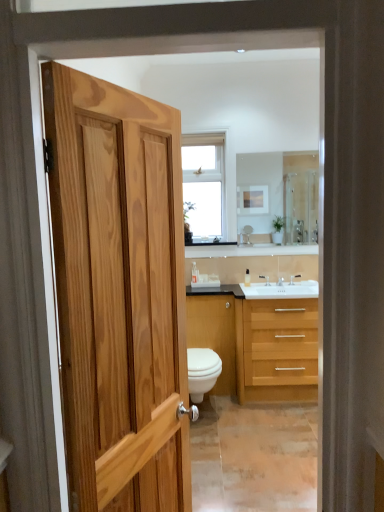
Describe the element at coordinates (257, 342) in the screenshot. I see `light wood/finished cabinet at center` at that location.

The width and height of the screenshot is (384, 512). What do you see at coordinates (247, 278) in the screenshot?
I see `translucent plastic bottle at center` at bounding box center [247, 278].

What do you see at coordinates (294, 278) in the screenshot? The height and width of the screenshot is (512, 384). I see `silver metallic faucet at center, which is the first faucet from right to left` at bounding box center [294, 278].

Identify the location of white glossy toilet at center. This screenshot has width=384, height=512. (202, 372).

At what (x,y) coordinates should I click in order to perform the action: click on silver metallic faucet at center, the 1th faucet from the left. Please return your answer as a coordinate pair (x, y). This screenshot has width=384, height=512. Looking at the image, I should click on (265, 279).

Can you see clear glass window at upper center touching satin nickel faucet at center, which appears as the 2th faucet when viewed from the left?

No, clear glass window at upper center is not next to satin nickel faucet at center, which appears as the 2th faucet when viewed from the left.

From the image's perspective, is clear glass window at upper center under satin nickel faucet at center, which is counted as the second faucet, starting from the right?

Actually, clear glass window at upper center appears above satin nickel faucet at center, which is counted as the second faucet, starting from the right, in the image.

At what (x,y) coordinates should I click in order to perform the action: click on faucet that is the 3rd one below the clear glass window at upper center (from a real-world perspective). Please return your answer as a coordinate pair (x, y). Looking at the image, I should click on (280, 281).

Considering the relative positions of clear glass window at upper center and satin nickel faucet at center, which appears as the 2th faucet when viewed from the left, in the image provided, is clear glass window at upper center behind satin nickel faucet at center, which appears as the 2th faucet when viewed from the left,?

Yes, clear glass window at upper center is behind satin nickel faucet at center, which appears as the 2th faucet when viewed from the left.

Choose the correct answer: Is white glossy toilet at center inside white glossy cabinet at center or outside it?

white glossy toilet at center is located beyond the bounds of white glossy cabinet at center.

Is white glossy toilet at center next to white glossy cabinet at center?

They are not placed beside each other.

From a real-world perspective, which object stands above the other?

white glossy cabinet at center, from a real-world perspective.

Considering the relative sizes of white glossy toilet at center and white glossy cabinet at center in the image provided, is white glossy toilet at center smaller than white glossy cabinet at center?

Correct, white glossy toilet at center occupies less space than white glossy cabinet at center.

Which of these two, translucent plastic bottle at center or white glossy cabinet at center, is smaller?

With smaller size is translucent plastic bottle at center.

How many degrees apart are the facing directions of translucent plastic bottle at center and white glossy cabinet at center?

There is a 8.05-degree angle between the facing directions of translucent plastic bottle at center and white glossy cabinet at center.

How distant is translucent plastic bottle at center from white glossy cabinet at center?

translucent plastic bottle at center and white glossy cabinet at center are 20.22 inches apart.

Is translucent plastic bottle at center looking in the opposite direction of white glossy cabinet at center?

translucent plastic bottle at center is not turned away from white glossy cabinet at center.

Is translucent plastic bottle at center in contact with satin nickel faucet at center, which is counted as the second faucet, starting from the right?

No, translucent plastic bottle at center is not in contact with satin nickel faucet at center, which is counted as the second faucet, starting from the right.

Consider the image. From a real-world perspective, which is physically above, translucent plastic bottle at center or satin nickel faucet at center, which is counted as the second faucet, starting from the right?

translucent plastic bottle at center.

Locate an element on the screen. faucet in front of the translucent plastic bottle at center is located at coordinates (280, 281).

Measure the distance between translucent plastic bottle at center and satin nickel faucet at center, which is counted as the second faucet, starting from the right.

translucent plastic bottle at center is 10.11 inches away from satin nickel faucet at center, which is counted as the second faucet, starting from the right.

Is white glossy cabinet at center surrounded by silver metallic faucet at center, which is the first faucet from right to left?

No.

Measure the distance from silver metallic faucet at center, which is the first faucet from right to left, to white glossy cabinet at center.

They are 31.11 inches apart.

Which of these two, silver metallic faucet at center, the 3th faucet when ordered from left to right, or white glossy cabinet at center, is thinner?

silver metallic faucet at center, the 3th faucet when ordered from left to right.

Is silver metallic faucet at center, which is the first faucet from right to left, taller or shorter than white glossy cabinet at center?

silver metallic faucet at center, which is the first faucet from right to left, is shorter than white glossy cabinet at center.

Is satin nickel faucet at center, which is counted as the second faucet, starting from the right, in front of or behind translucent plastic bottle at center in the image?

satin nickel faucet at center, which is counted as the second faucet, starting from the right, is in front of translucent plastic bottle at center.

Considering the relative sizes of satin nickel faucet at center, which is counted as the second faucet, starting from the right, and translucent plastic bottle at center in the image provided, is satin nickel faucet at center, which is counted as the second faucet, starting from the right, bigger than translucent plastic bottle at center?

Yes.

From a real-world perspective, is satin nickel faucet at center, which is counted as the second faucet, starting from the right, beneath translucent plastic bottle at center?

Yes.

You are a GUI agent. You are given a task and a screenshot of the screen. Output one action in this format:
    pyautogui.click(x=<x>, y=<y>)
    Task: Click on the toiletry above the satin nickel faucet at center, which is counted as the second faucet, starting from the right (from a real-world perspective)
    The height and width of the screenshot is (512, 384).
    Given the screenshot: What is the action you would take?
    pyautogui.click(x=247, y=278)

Can you confirm if clear glass window at upper center is positioned to the left of translucent plastic bottle at center?

Yes, clear glass window at upper center is to the left of translucent plastic bottle at center.

Is clear glass window at upper center inside the boundaries of translucent plastic bottle at center, or outside?

clear glass window at upper center is located beyond the bounds of translucent plastic bottle at center.

From the image's perspective, between clear glass window at upper center and translucent plastic bottle at center, who is located below?

translucent plastic bottle at center appears lower in the image.

Is clear glass window at upper center looking in the opposite direction of translucent plastic bottle at center?

No, clear glass window at upper center is not facing away from translucent plastic bottle at center.

At what (x,y) coordinates should I click in order to perform the action: click on faucet in front of the clear glass window at upper center. Please return your answer as a coordinate pair (x, y). The height and width of the screenshot is (512, 384). Looking at the image, I should click on (280, 281).

Where is `toilet on the left of white glossy cabinet at center`? toilet on the left of white glossy cabinet at center is located at coordinates (202, 372).

Based on their spatial positions, is clear glass window at upper center or translucent plastic bottle at center further from silver metallic faucet at center, the 3th faucet when ordered from left to right?

clear glass window at upper center.

Looking at the image, which one is located closer to satin nickel faucet at center, which appears as the 2th faucet when viewed from the left, silver metallic faucet at center, which is counted as the 3th faucet, starting from the right, or silver metallic faucet at center, which is the first faucet from right to left?

Based on the image, silver metallic faucet at center, which is the first faucet from right to left, appears to be nearer to satin nickel faucet at center, which appears as the 2th faucet when viewed from the left.

Estimate the real-world distances between objects in this image. Which object is further from clear glass window at upper center, light wood/finished cabinet at center or clear glass mirror at upper center?

light wood/finished cabinet at center.

Based on their spatial positions, is light wood/finished cabinet at center or clear glass window at upper center closer to satin nickel faucet at center, which is counted as the second faucet, starting from the right?

light wood/finished cabinet at center.

When comparing their distances from light wood/finished cabinet at center, does clear glass mirror at upper center or white glossy toilet at center seem closer?

Among the two, white glossy toilet at center is located nearer to light wood/finished cabinet at center.

From the image, which object appears to be farther from silver metallic faucet at center, the 3th faucet when ordered from left to right, silver metallic faucet at center, the 1th faucet from the left, or light wood/finished cabinet at center?

Among the two, light wood/finished cabinet at center is located further to silver metallic faucet at center, the 3th faucet when ordered from left to right.

Looking at the image, which one is located closer to satin nickel faucet at center, which is counted as the second faucet, starting from the right, translucent plastic bottle at center or light wood/finished cabinet at center?

translucent plastic bottle at center lies closer to satin nickel faucet at center, which is counted as the second faucet, starting from the right, than the other object.

Looking at the image, which one is located closer to satin nickel faucet at center, which appears as the 2th faucet when viewed from the left, white glossy cabinet at center or white glossy toilet at center?

white glossy cabinet at center lies closer to satin nickel faucet at center, which appears as the 2th faucet when viewed from the left, than the other object.

Image resolution: width=384 pixels, height=512 pixels. I want to click on bathroom cabinet between clear glass window at upper center and white glossy cabinet at center in the vertical direction, so click(257, 342).

The image size is (384, 512). In order to click on bathroom cabinet between white glossy cabinet at center and satin nickel faucet at center, which appears as the 2th faucet when viewed from the left in this screenshot , I will do `click(257, 342)`.

You are a GUI agent. You are given a task and a screenshot of the screen. Output one action in this format:
    pyautogui.click(x=<x>, y=<y>)
    Task: Click on the bathroom cabinet situated between white glossy cabinet at center and silver metallic faucet at center, which is the first faucet from right to left, from left to right
    Image resolution: width=384 pixels, height=512 pixels.
    Given the screenshot: What is the action you would take?
    pyautogui.click(x=257, y=342)

The width and height of the screenshot is (384, 512). I want to click on bathroom cabinet that lies between clear glass mirror at upper center and white glossy toilet at center from top to bottom, so click(257, 342).